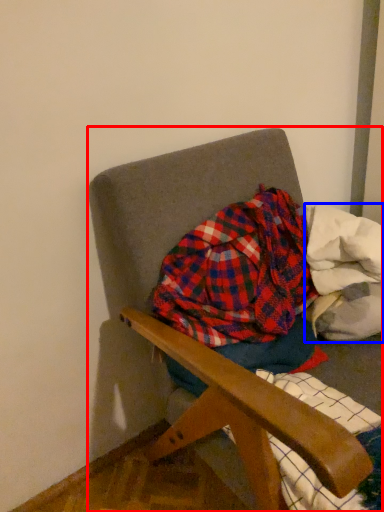
Question: Among these objects, which one is farthest to the camera, chair (highlighted by a red box) or material (highlighted by a blue box)?

Choices:
 (A) chair
 (B) material

Answer: (B)